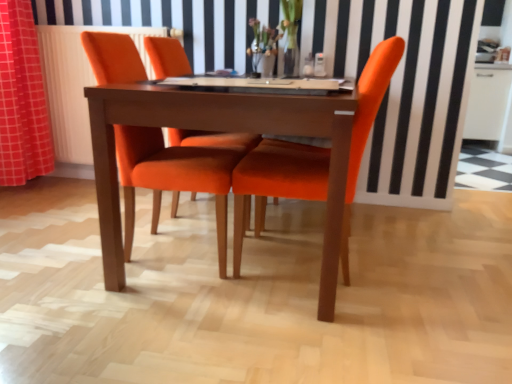
You are a GUI agent. You are given a task and a screenshot of the screen. Output one action in this format:
    pyautogui.click(x=<x>, y=<y>)
    Task: Click on the empty space that is ontop of white radiator at left (from a real-world perspective)
    
    Given the screenshot: What is the action you would take?
    pyautogui.click(x=94, y=14)